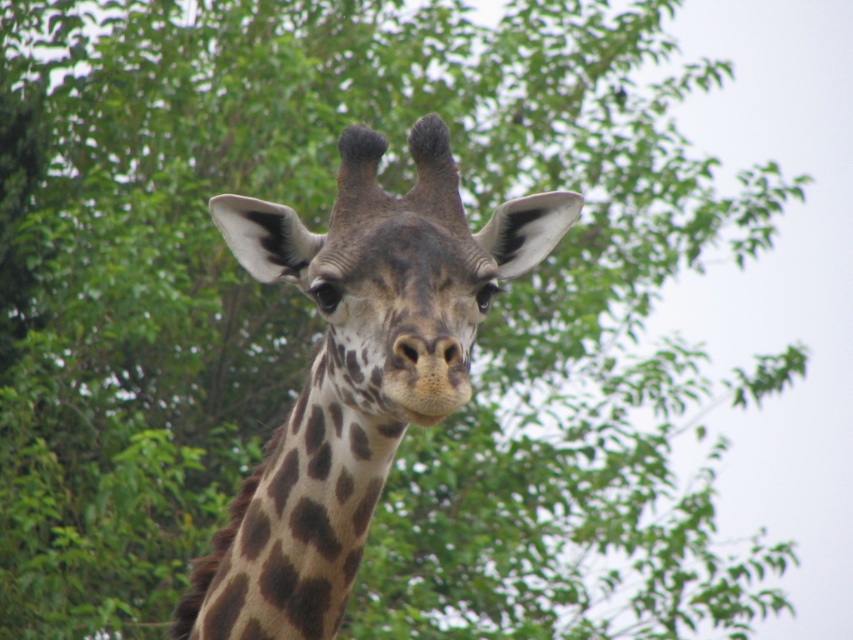
Question: Is brown spotted giraffe at center to the left of brown spotted neck at center from the viewer's perspective?

Choices:
 (A) no
 (B) yes

Answer: (A)

Question: Among these objects, which one is farthest from the camera?

Choices:
 (A) brown spotted giraffe at center
 (B) brown spotted neck at center

Answer: (B)

Question: Considering the relative positions of brown spotted giraffe at center and brown spotted neck at center in the image provided, where is brown spotted giraffe at center located with respect to brown spotted neck at center?

Choices:
 (A) left
 (B) right

Answer: (B)

Question: Among these points, which one is nearest to the camera?

Choices:
 (A) pyautogui.click(x=277, y=566)
 (B) pyautogui.click(x=276, y=260)

Answer: (A)

Question: Where is brown spotted giraffe at center located in relation to brown spotted neck at center in the image?

Choices:
 (A) right
 (B) left

Answer: (A)

Question: Among these points, which one is farthest from the camera?

Choices:
 (A) (317, 454)
 (B) (213, 577)

Answer: (B)